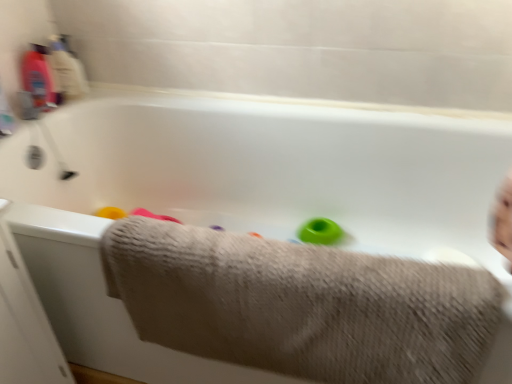
Question: Does translucent plastic bottle at upper left appear on the right side of beige textured towel at lower center?

Choices:
 (A) yes
 (B) no

Answer: (B)

Question: From the image's perspective, is translucent plastic bottle at upper left below beige textured towel at lower center?

Choices:
 (A) yes
 (B) no

Answer: (B)

Question: Considering the relative sizes of translucent plastic bottle at upper left and beige textured towel at lower center in the image provided, is translucent plastic bottle at upper left thinner than beige textured towel at lower center?

Choices:
 (A) yes
 (B) no

Answer: (A)

Question: Does translucent plastic bottle at upper left come in front of beige textured towel at lower center?

Choices:
 (A) yes
 (B) no

Answer: (B)

Question: Can you confirm if translucent plastic bottle at upper left is bigger than beige textured towel at lower center?

Choices:
 (A) no
 (B) yes

Answer: (A)

Question: From the image's perspective, is translucent plastic bottle at upper left located above beige textured towel at lower center?

Choices:
 (A) yes
 (B) no

Answer: (A)

Question: Is beige textured towel at lower center placed right next to translucent plastic bottle at upper left?

Choices:
 (A) yes
 (B) no

Answer: (B)

Question: Can you confirm if beige textured towel at lower center is bigger than translucent plastic bottle at upper left?

Choices:
 (A) yes
 (B) no

Answer: (A)

Question: From a real-world perspective, is beige textured towel at lower center below translucent plastic bottle at upper left?

Choices:
 (A) yes
 (B) no

Answer: (A)

Question: Is the position of beige textured towel at lower center more distant than that of translucent plastic bottle at upper left?

Choices:
 (A) no
 (B) yes

Answer: (A)

Question: Considering the relative sizes of beige textured towel at lower center and translucent plastic bottle at upper left in the image provided, is beige textured towel at lower center thinner than translucent plastic bottle at upper left?

Choices:
 (A) no
 (B) yes

Answer: (A)

Question: Is beige textured towel at lower center outside translucent plastic bottle at upper left?

Choices:
 (A) no
 (B) yes

Answer: (B)

Question: Is green rubber ring at center not near beige textured towel at lower center?

Choices:
 (A) yes
 (B) no

Answer: (B)